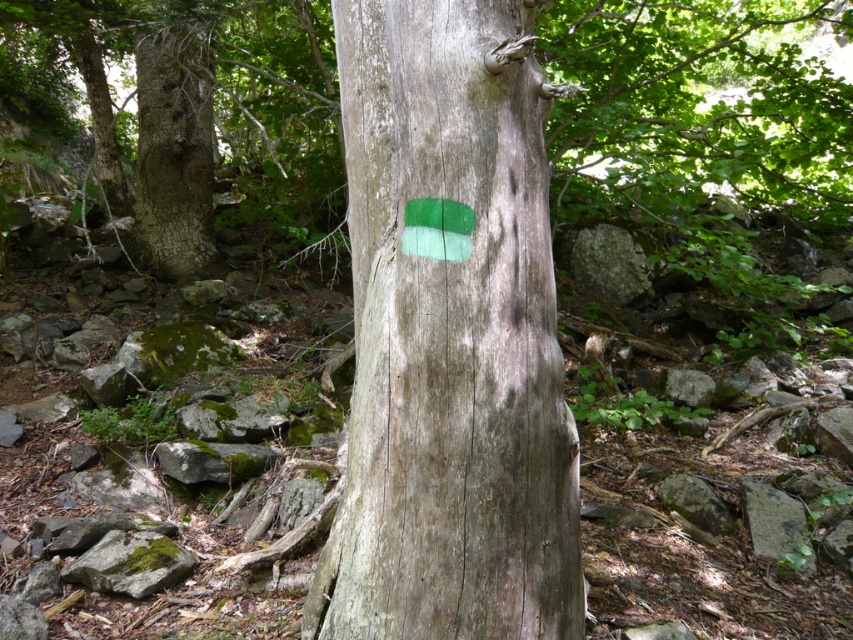
From the picture: Does green painted wood at center appear on the right side of green mossy rock at lower left?

No, green painted wood at center is not to the right of green mossy rock at lower left.

Can you confirm if green painted wood at center is positioned to the left of green mossy rock at lower left?

Yes, green painted wood at center is to the left of green mossy rock at lower left.

Does point (26, 67) come farther from viewer compared to point (155, 545)?

Yes, point (26, 67) is behind point (155, 545).

Locate an element on the screen. green painted wood at center is located at coordinates (202, 116).

Who is taller, green matte paint at center or green painted wood at center?

Standing taller between the two is green painted wood at center.

Between green matte paint at center and green painted wood at center, which one has less height?

With less height is green matte paint at center.

Is point (447, 8) behind point (276, 122)?

No, it is in front of (276, 122).

The height and width of the screenshot is (640, 853). I want to click on green matte paint at center, so click(450, 337).

Does green matte paint at center have a greater height compared to green mossy rock at lower left?

Yes, green matte paint at center is taller than green mossy rock at lower left.

Is green matte paint at center below green mossy rock at lower left?

Incorrect, green matte paint at center is not positioned below green mossy rock at lower left.

This screenshot has width=853, height=640. What are the coordinates of `green matte paint at center` in the screenshot? It's located at (450, 337).